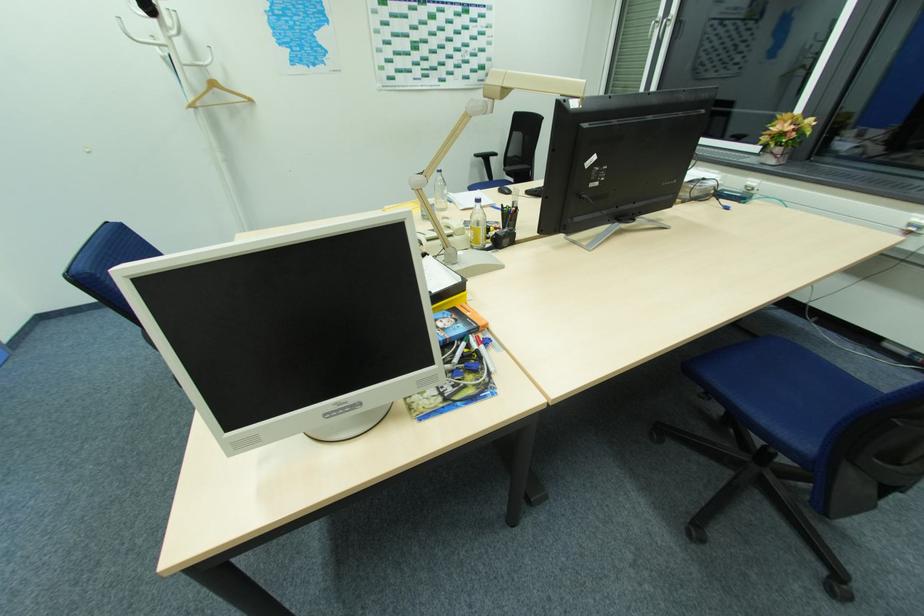
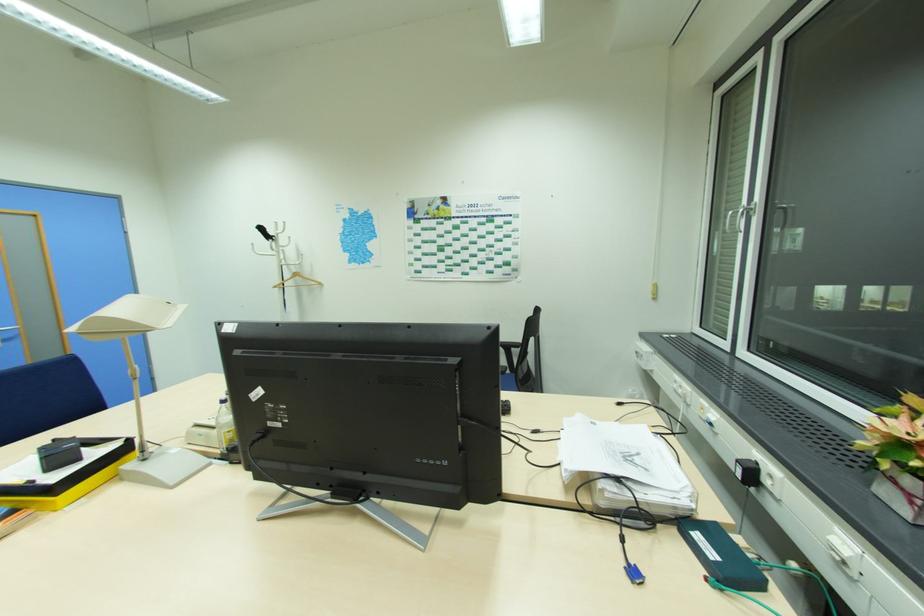
Find the pixel in the second image that matches pixel 783 150 in the first image.

(912, 484)